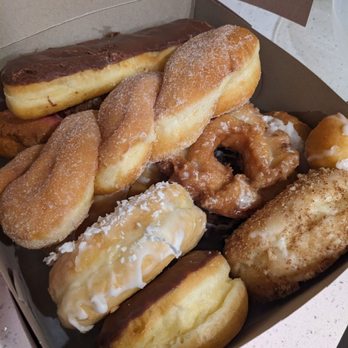
Find the location of `small triangular view of the dark brown floor`. small triangular view of the dark brown floor is located at coordinates (344, 342).